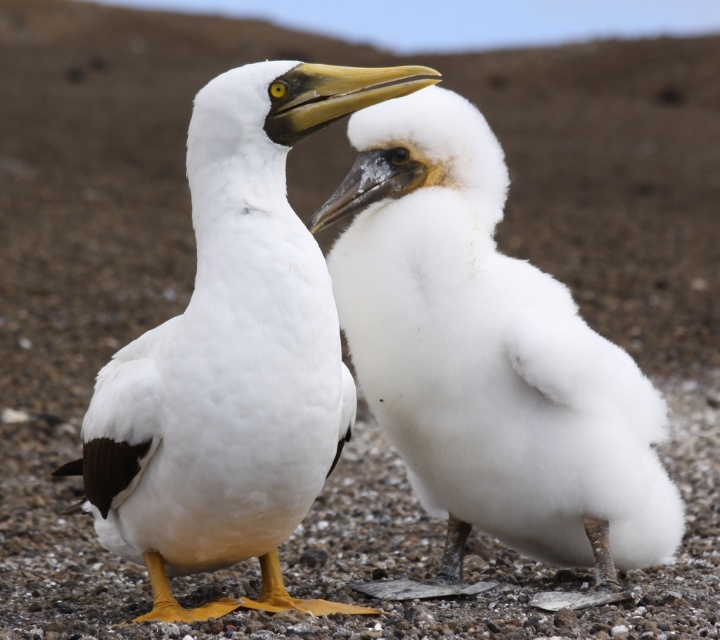
You are a birdwatcher observing two birds on a sandy beach. You notice a white fluffy bird at center and a white matte bird at center. Which one is smaller in size?

The white fluffy bird at center is smaller in size compared to the white matte bird at center.

You are a birdwatcher observing the scene. You want to take a photo of the white fluffy bird at center. Where should you point your camera to capture it?

You should point your camera to the coordinates point (492,362) to capture the white fluffy bird at center.